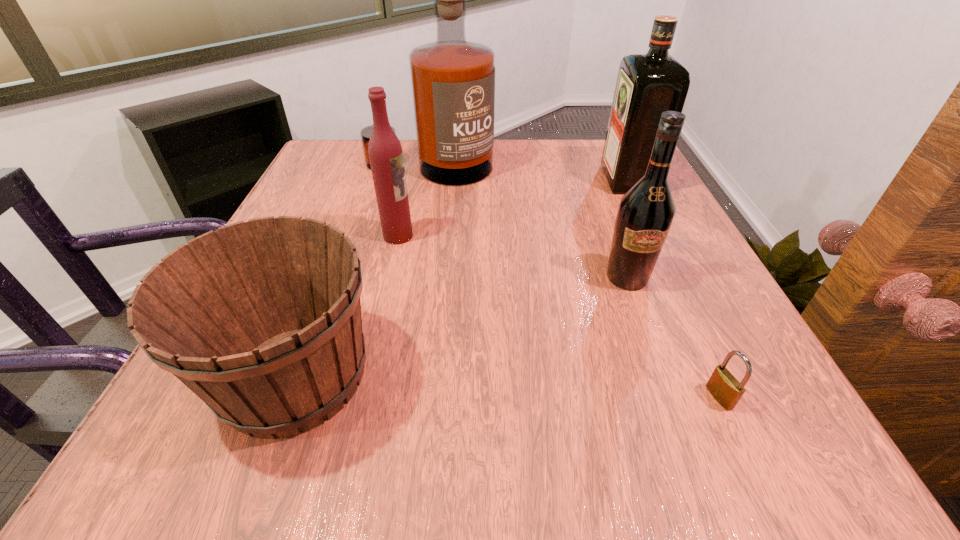
The width and height of the screenshot is (960, 540). I want to click on vacant space located on the front label of the second tallest liquor, so tap(499, 180).

What are the coordinates of `vacant space located 0.110m on the label of the wine bottle` in the screenshot? It's located at (652, 345).

At what (x,y) coordinates should I click in order to perform the action: click on vacant area located 0.160m on the label of the nearest liquor. Please return your answer as a coordinate pair (x, y). The width and height of the screenshot is (960, 540). Looking at the image, I should click on (493, 236).

At what (x,y) coordinates should I click in order to perform the action: click on blank space located 0.290m on the right of the wine bucket. Please return your answer as a coordinate pair (x, y). Looking at the image, I should click on (585, 375).

Where is `blank space located on the left of the shortest object`? blank space located on the left of the shortest object is located at coordinates (593, 397).

You are a GUI agent. You are given a task and a screenshot of the screen. Output one action in this format:
    pyautogui.click(x=<x>, y=<y>)
    Task: Click on the wine bucket that is positioned at the near edge
    This screenshot has height=540, width=960.
    Given the screenshot: What is the action you would take?
    pyautogui.click(x=261, y=319)

Where is `padlock situated at the near edge`? The height and width of the screenshot is (540, 960). padlock situated at the near edge is located at coordinates pyautogui.click(x=724, y=387).

This screenshot has width=960, height=540. What are the coordinates of `liquor located at the left edge` in the screenshot? It's located at (453, 80).

Image resolution: width=960 pixels, height=540 pixels. I want to click on wine bucket that is at the left edge, so [x=261, y=319].

Find the location of `liquor that is at the right edge`. liquor that is at the right edge is located at coordinates (647, 85).